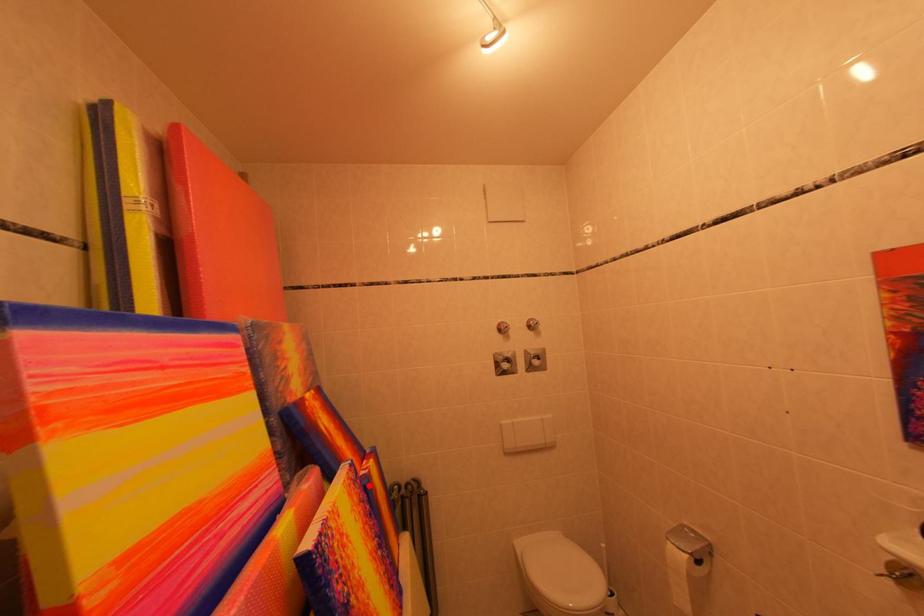
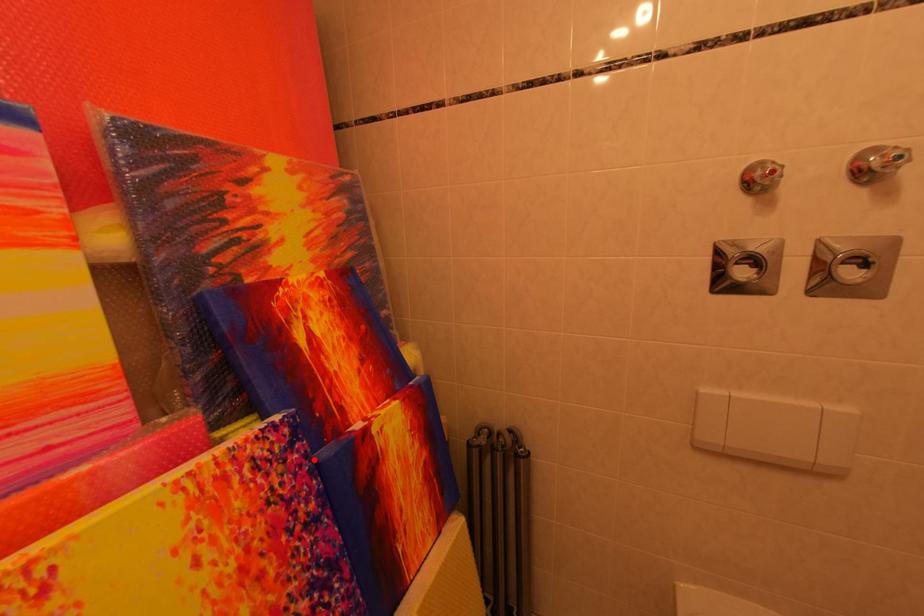
I am providing you with two images of the same scene from different viewpoints. A red point is marked on the first image and another point is marked on the second image. Does the point marked in image1 correspond to the same location as the one in image2?

Yes